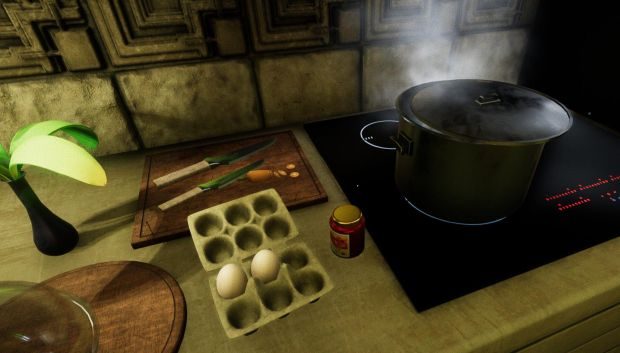
At what (x,y) coordinates should I click in order to perform the action: click on glass jar. Please return your answer as a coordinate pair (x, y). This screenshot has width=620, height=353. Looking at the image, I should click on (356, 242).